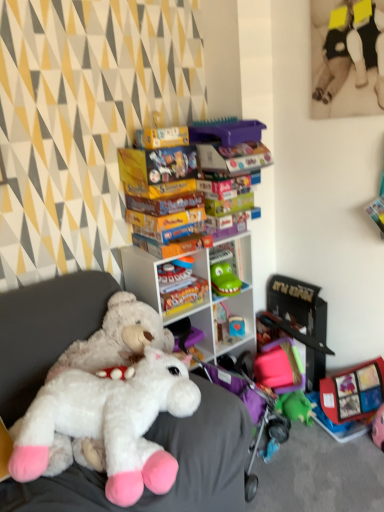
Question: Does smooth plastic toy at center, which is counted as the second toy, starting from the bottom, have a lesser width compared to white plush toy at center?

Choices:
 (A) yes
 (B) no

Answer: (A)

Question: Does smooth plastic toy at center, which ranks as the 2th toy in top-to-bottom order, lie in front of white plush toy at center?

Choices:
 (A) yes
 (B) no

Answer: (B)

Question: From a real-world perspective, is smooth plastic toy at center, which is the first toy from back to front, located beneath white plush toy at center?

Choices:
 (A) no
 (B) yes

Answer: (B)

Question: Does smooth plastic toy at center, the 3th toy from the front, have a lesser height compared to white plush toy at center?

Choices:
 (A) yes
 (B) no

Answer: (A)

Question: Can you confirm if smooth plastic toy at center, which is the first toy from back to front, is positioned to the left of white plush toy at center?

Choices:
 (A) no
 (B) yes

Answer: (A)

Question: From a real-world perspective, is white plastic shelf at center positioned above or below smooth plastic toy at center, which ranks as the 2th toy in top-to-bottom order?

Choices:
 (A) below
 (B) above

Answer: (B)

Question: Is white plastic shelf at center in front of or behind smooth plastic toy at center, the 3th toy from the front, in the image?

Choices:
 (A) front
 (B) behind

Answer: (A)

Question: Is white plastic shelf at center wider or thinner than smooth plastic toy at center, the 3th toy from the front?

Choices:
 (A) thin
 (B) wide

Answer: (B)

Question: Is white plastic shelf at center inside or outside of smooth plastic toy at center, the 3th toy from the front?

Choices:
 (A) outside
 (B) inside

Answer: (A)

Question: In terms of width, does white plush toy at center look wider or thinner when compared to white plastic shelf at center?

Choices:
 (A) wide
 (B) thin

Answer: (A)

Question: In the image, is white plush toy at center positioned in front of or behind white plastic shelf at center?

Choices:
 (A) behind
 (B) front

Answer: (B)

Question: Is white plush toy at center taller or shorter than white plastic shelf at center?

Choices:
 (A) short
 (B) tall

Answer: (A)

Question: From a real-world perspective, is white plush toy at center above or below white plastic shelf at center?

Choices:
 (A) below
 (B) above

Answer: (A)

Question: From a real-world perspective, relative to white plush toy at center, is smooth plastic toy at center, which ranks as the 2th toy in top-to-bottom order, vertically above or below?

Choices:
 (A) below
 (B) above

Answer: (A)

Question: Does point (243, 327) appear closer or farther from the camera than point (61, 298)?

Choices:
 (A) closer
 (B) farther

Answer: (B)